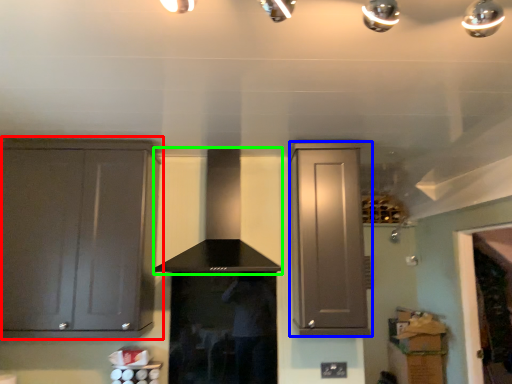
Question: Considering the real-world distances, which object is closest to cabinetry (highlighted by a red box)? cabinetry (highlighted by a blue box) or vent (highlighted by a green box).

Choices:
 (A) cabinetry
 (B) vent

Answer: (B)